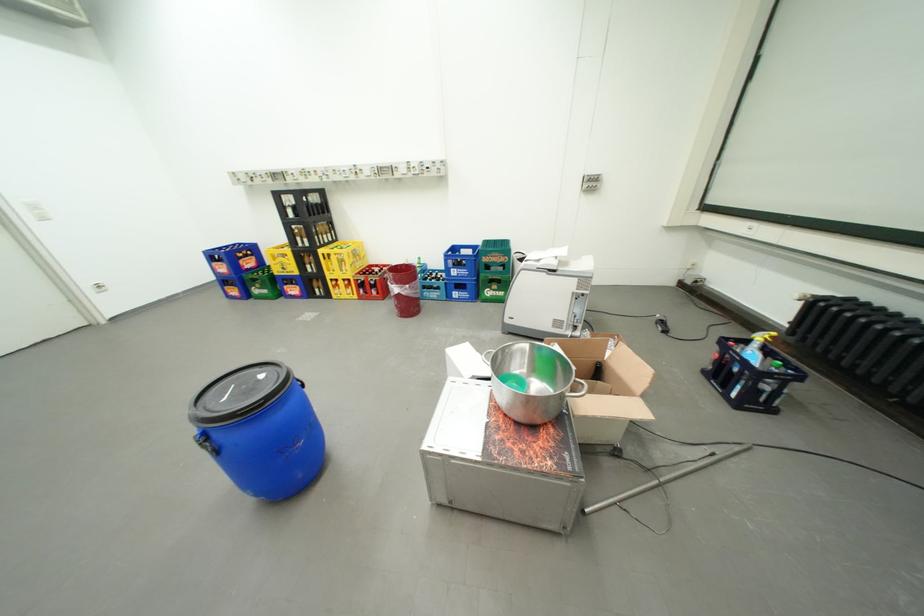
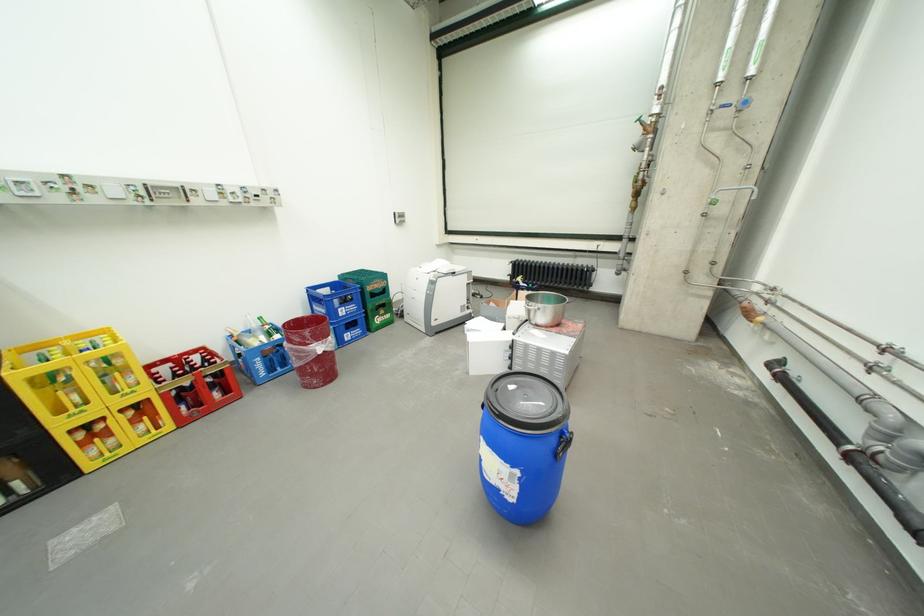
Where in the second image is the point corresponding to [408,269] from the first image?

(297, 328)